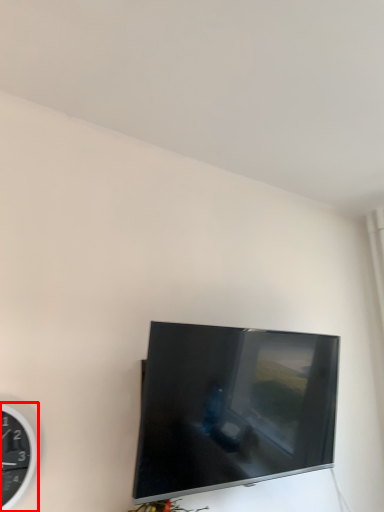
Question: Considering the relative positions of wall clock (annotated by the red box) and television in the image provided, where is wall clock (annotated by the red box) located with respect to the staircase?

Choices:
 (A) left
 (B) right

Answer: (A)